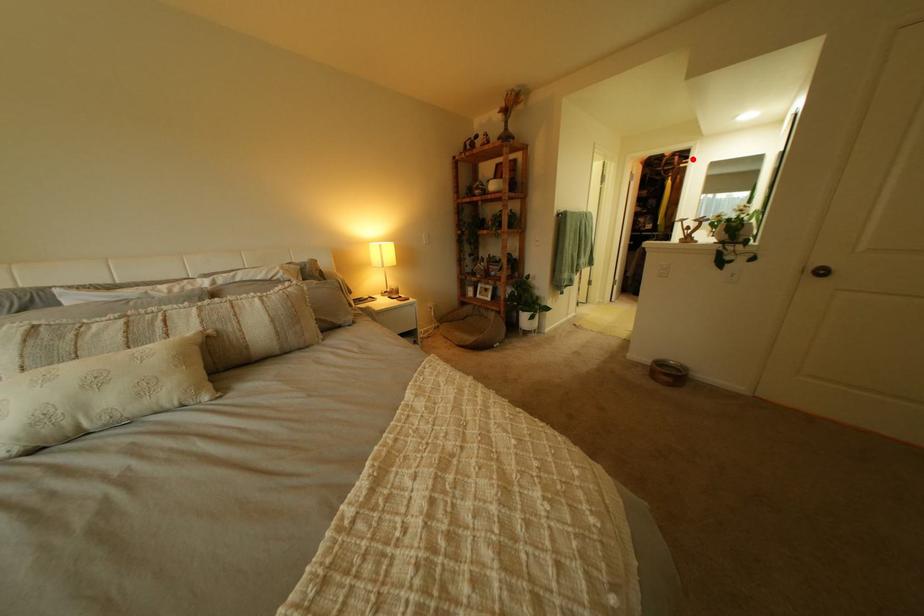
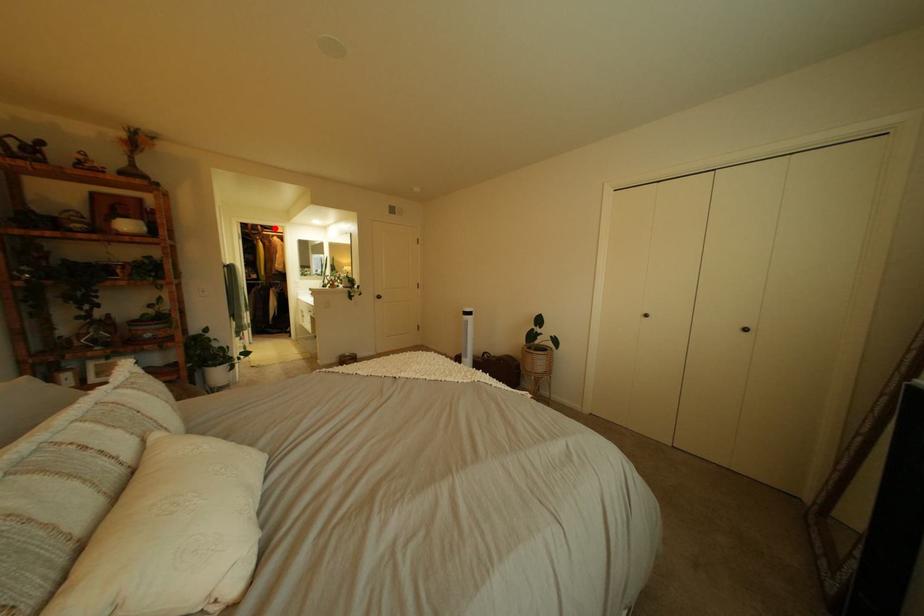
I am providing you with two images of the same scene from different viewpoints. A red point is marked on the first image and another point is marked on the second image. Is the marked point in image1 the same physical position as the marked point in image2?

Yes